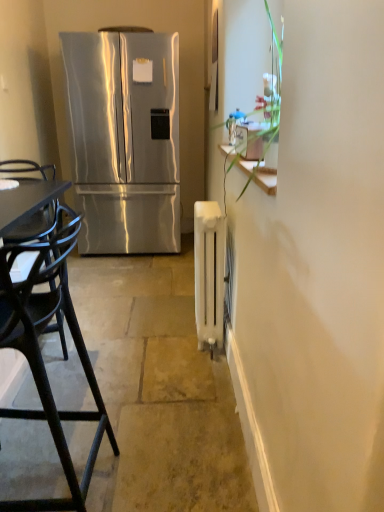
Question: Considering the relative sizes of black plastic chair at left and stainless steel refrigerator at left in the image provided, is black plastic chair at left smaller than stainless steel refrigerator at left?

Choices:
 (A) yes
 (B) no

Answer: (A)

Question: Does black plastic chair at left have a greater height compared to stainless steel refrigerator at left?

Choices:
 (A) no
 (B) yes

Answer: (A)

Question: From the image's perspective, is black plastic chair at left below stainless steel refrigerator at left?

Choices:
 (A) no
 (B) yes

Answer: (B)

Question: Is black plastic chair at left closer to camera compared to stainless steel refrigerator at left?

Choices:
 (A) no
 (B) yes

Answer: (B)

Question: Does black plastic chair at left have a larger size compared to stainless steel refrigerator at left?

Choices:
 (A) yes
 (B) no

Answer: (B)

Question: Based on their sizes in the image, would you say stainless steel refrigerator at left is bigger or smaller than white matte radiator at right?

Choices:
 (A) small
 (B) big

Answer: (B)

Question: From a real-world perspective, is stainless steel refrigerator at left positioned above or below white matte radiator at right?

Choices:
 (A) above
 (B) below

Answer: (A)

Question: Looking at their shapes, would you say stainless steel refrigerator at left is wider or thinner than white matte radiator at right?

Choices:
 (A) wide
 (B) thin

Answer: (B)

Question: Would you say stainless steel refrigerator at left is to the left or to the right of white matte radiator at right in the picture?

Choices:
 (A) right
 (B) left

Answer: (B)

Question: Is stainless steel refrigerator at left bigger or smaller than white matte radiator at center?

Choices:
 (A) small
 (B) big

Answer: (B)

Question: Is stainless steel refrigerator at left taller or shorter than white matte radiator at center?

Choices:
 (A) short
 (B) tall

Answer: (B)

Question: Is stainless steel refrigerator at left to the left or to the right of white matte radiator at center in the image?

Choices:
 (A) right
 (B) left

Answer: (B)

Question: Considering their positions, is stainless steel refrigerator at left located in front of or behind white matte radiator at center?

Choices:
 (A) front
 (B) behind

Answer: (B)

Question: From their relative heights in the image, would you say stainless steel refrigerator at left is taller or shorter than satin silver exhaust hood at upper center?

Choices:
 (A) tall
 (B) short

Answer: (A)

Question: From a real-world perspective, is stainless steel refrigerator at left physically located above or below satin silver exhaust hood at upper center?

Choices:
 (A) above
 (B) below

Answer: (B)